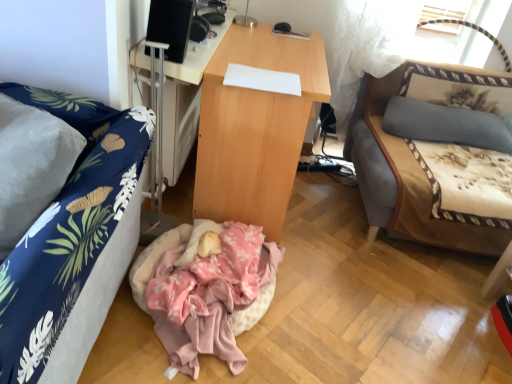
Question: Considering the relative sizes of wooden desk at center, the 2th desk in the right-to-left sequence, and beige fabric studio couch at right, the first studio couch from the right, in the image provided, is wooden desk at center, the 2th desk in the right-to-left sequence, smaller than beige fabric studio couch at right, the first studio couch from the right,?

Choices:
 (A) yes
 (B) no

Answer: (A)

Question: From a real-world perspective, does wooden desk at center, the 2th desk in the right-to-left sequence, sit lower than beige fabric studio couch at right, the first studio couch viewed from the back?

Choices:
 (A) yes
 (B) no

Answer: (B)

Question: From a real-world perspective, is wooden desk at center, the 2th desk in the right-to-left sequence, physically above beige fabric studio couch at right, the first studio couch from the right?

Choices:
 (A) yes
 (B) no

Answer: (A)

Question: From the image's perspective, would you say wooden desk at center, arranged as the 1th desk when viewed from the left, is shown under beige fabric studio couch at right, the first studio couch viewed from the back?

Choices:
 (A) yes
 (B) no

Answer: (B)

Question: Would you say wooden desk at center, arranged as the 1th desk when viewed from the left, is a long distance from beige fabric studio couch at right, which is counted as the 2th studio couch, starting from the front?

Choices:
 (A) yes
 (B) no

Answer: (A)

Question: Considering their positions, is black matte speaker at upper center located in front of or behind light brown wood desk at center, the second desk positioned from the left?

Choices:
 (A) behind
 (B) front

Answer: (B)

Question: From the image's perspective, is black matte speaker at upper center positioned above or below light brown wood desk at center, the second desk positioned from the left?

Choices:
 (A) above
 (B) below

Answer: (A)

Question: From a real-world perspective, is black matte speaker at upper center physically located above or below light brown wood desk at center, the second desk positioned from the left?

Choices:
 (A) above
 (B) below

Answer: (A)

Question: Looking at their shapes, would you say black matte speaker at upper center is wider or thinner than light brown wood desk at center, the second desk positioned from the left?

Choices:
 (A) thin
 (B) wide

Answer: (A)

Question: In terms of width, does black matte speaker at upper center look wider or thinner when compared to blue fabric couch at left, which is the 2th studio couch from back to front?

Choices:
 (A) wide
 (B) thin

Answer: (B)

Question: Based on their positions, is black matte speaker at upper center located to the left or right of blue fabric couch at left, acting as the 1th studio couch starting from the front?

Choices:
 (A) left
 (B) right

Answer: (B)

Question: In terms of height, does black matte speaker at upper center look taller or shorter compared to blue fabric couch at left, which is counted as the first studio couch, starting from the left?

Choices:
 (A) short
 (B) tall

Answer: (A)

Question: Is point coord(174,46) positioned closer to the camera than point coord(88,99)?

Choices:
 (A) farther
 (B) closer

Answer: (A)

Question: Considering the positions of black matte speaker at upper center and wooden desk at center, the 2th desk in the right-to-left sequence, in the image, is black matte speaker at upper center wider or thinner than wooden desk at center, the 2th desk in the right-to-left sequence,?

Choices:
 (A) thin
 (B) wide

Answer: (B)

Question: From a real-world perspective, is black matte speaker at upper center above or below wooden desk at center, the 2th desk in the right-to-left sequence?

Choices:
 (A) above
 (B) below

Answer: (A)